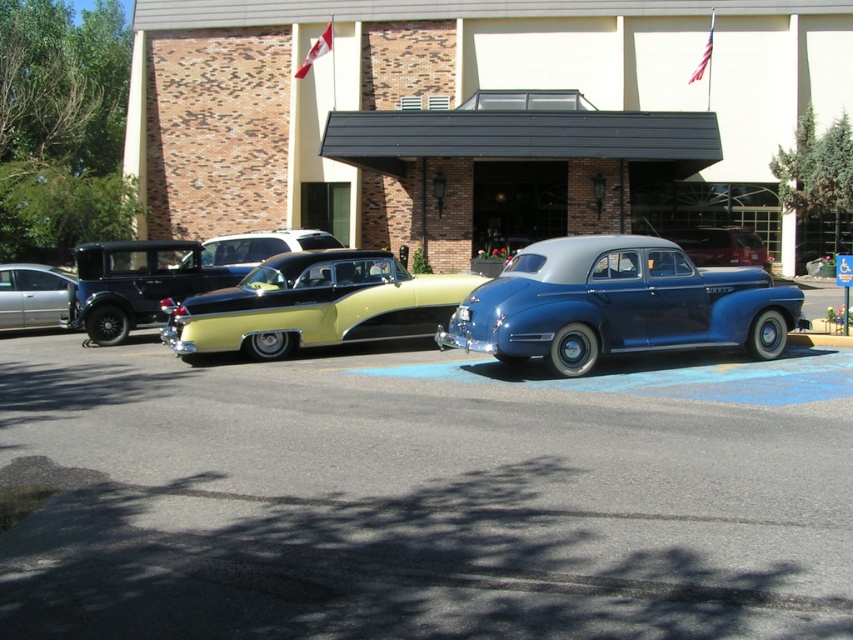
You are standing at the entrance of the building and want to take a photo of the yellow matte car at center. According to the coordinates provided, where should you position yourself to capture the car in the frame?

The yellow matte car at center is located at coordinates point (163,275), so you should position yourself at the entrance facing towards the parking area to capture the car in the frame.

You are a pedestrian standing in front of the building. You want to walk from the entrance to the silver metallic sedan at left. Is the yellow matte car at center blocking your path?

The yellow matte car at center is in front of the silver metallic sedan at left, so it is blocking the path to the silver metallic sedan at left.

You are standing in front of the building and want to take a photo of the silver metallic sedan at left and the yellow glossy car at center. Which car should you focus on first to ensure it appears larger in your photo?

The yellow glossy car at center is closer to the viewer than the silver metallic sedan at left, so focusing on the yellow glossy car at center first will make it appear larger in the photo.